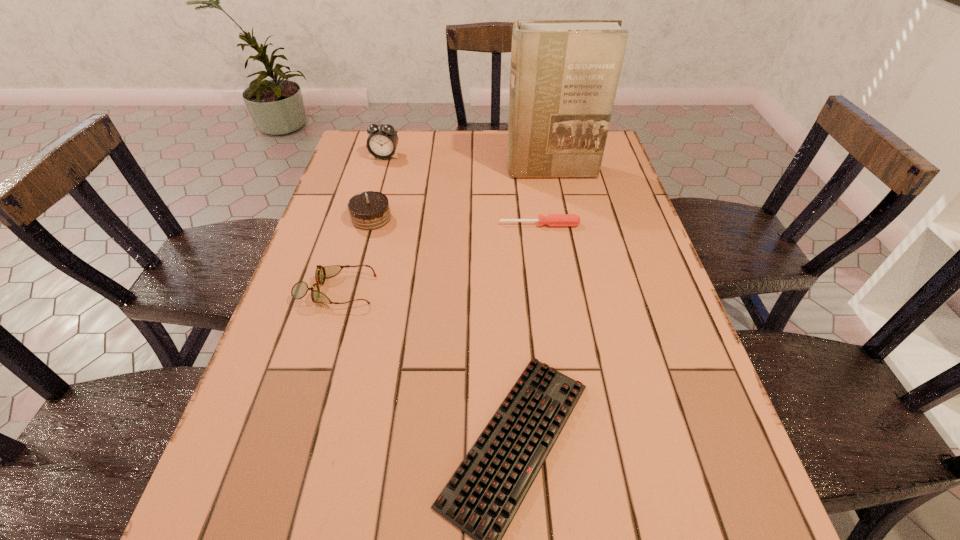
Where is `object present at the far left corner`? The image size is (960, 540). object present at the far left corner is located at coordinates (382, 141).

Where is `object situated at the far right corner`? Image resolution: width=960 pixels, height=540 pixels. object situated at the far right corner is located at coordinates (564, 74).

This screenshot has height=540, width=960. In order to click on free space at the far edge of the desktop in this screenshot , I will do `click(468, 134)`.

This screenshot has height=540, width=960. What are the coordinates of `vacant space at the left edge` in the screenshot? It's located at (349, 278).

At what (x,y) coordinates should I click in order to perform the action: click on blank space at the right edge. Please return your answer as a coordinate pair (x, y). Looking at the image, I should click on (738, 487).

You are a GUI agent. You are given a task and a screenshot of the screen. Output one action in this format:
    pyautogui.click(x=<x>, y=<y>)
    Task: Click on the unoccupied area between the fourth tallest object and the fifth nearest object
    The height and width of the screenshot is (540, 960).
    Given the screenshot: What is the action you would take?
    pyautogui.click(x=444, y=231)

This screenshot has height=540, width=960. Find the location of `free space that is in between the phonebook and the screwdriver`. free space that is in between the phonebook and the screwdriver is located at coordinates (545, 198).

Locate an element on the screen. The image size is (960, 540). free spot between the tallest object and the second shortest object is located at coordinates (545, 198).

Locate an element on the screen. unoccupied position between the alarm clock and the second shortest object is located at coordinates (462, 191).

Where is `free space between the chocolate cake and the screwdriver`? The image size is (960, 540). free space between the chocolate cake and the screwdriver is located at coordinates (455, 221).